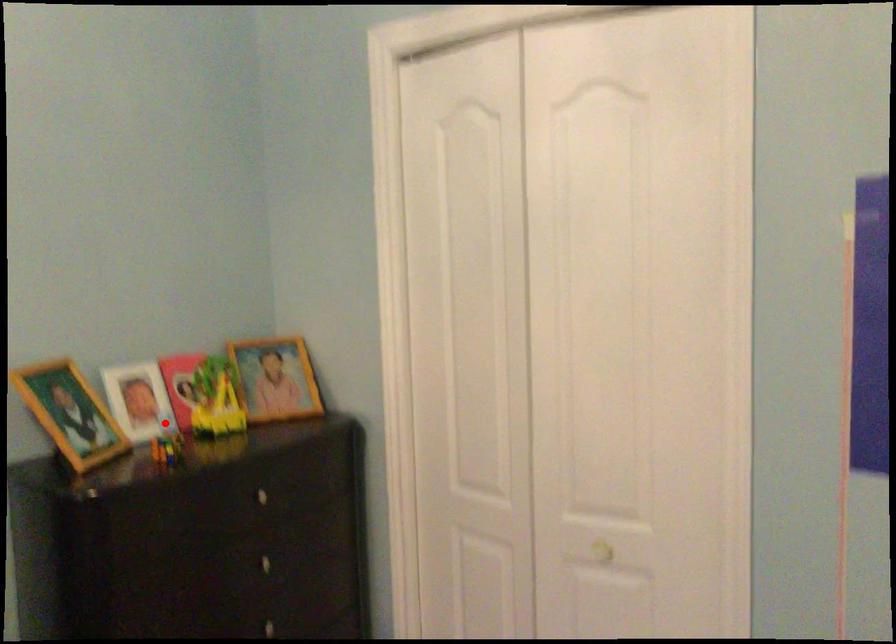
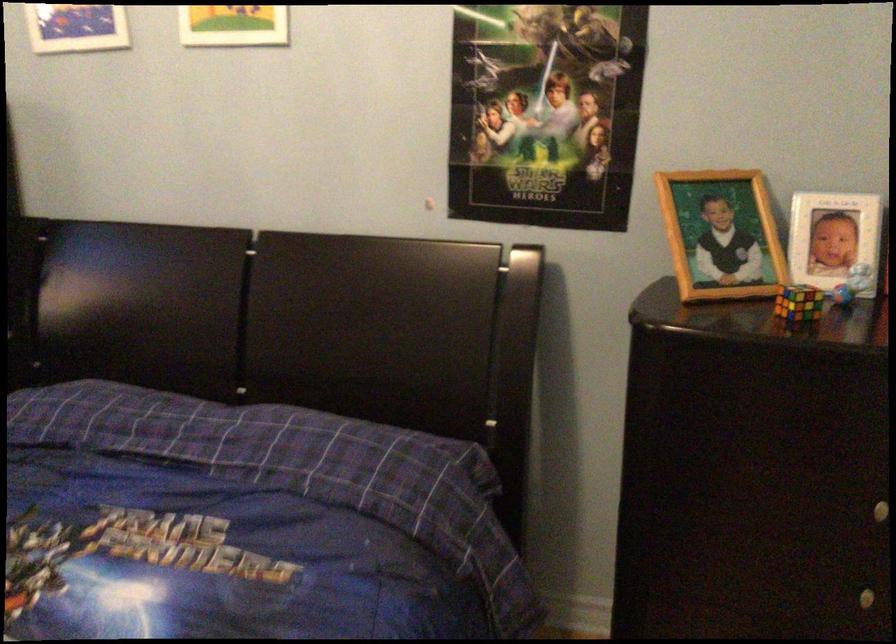
Question: I am providing you with two images of the same scene from different viewpoints. Image1 has a red point marked. In image2, the corresponding 3D location appears at what relative position? Reply with the corresponding letter.

Choices:
 (A) Closer
 (B) Farther

Answer: (A)